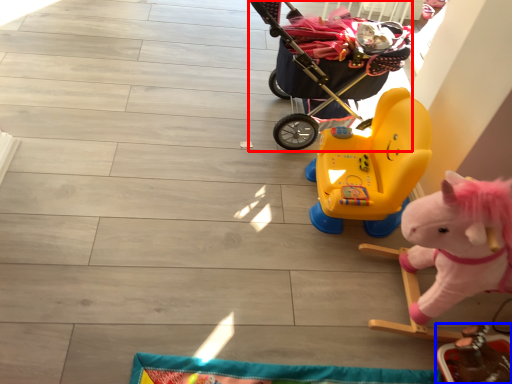
Question: Which of the following is the farthest to the observer, baby carriage (highlighted by a red box) or toy (highlighted by a blue box)?

Choices:
 (A) baby carriage
 (B) toy

Answer: (A)